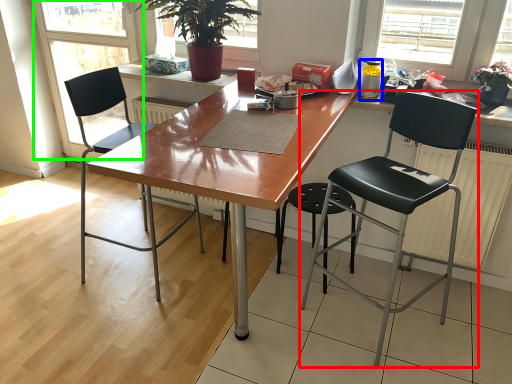
Question: Based on their relative distances, which object is nearer to chair (highlighted by a red box)? Choose from bottle (highlighted by a blue box) and screen door (highlighted by a green box).

Choices:
 (A) bottle
 (B) screen door

Answer: (A)